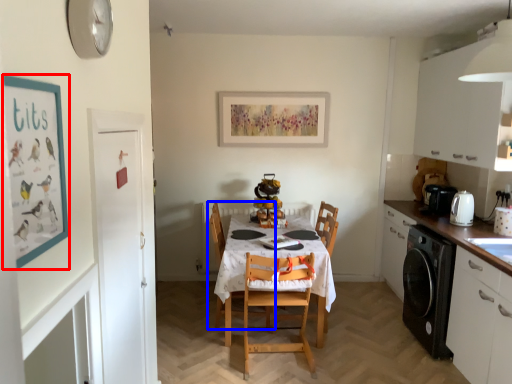
Question: Which object is further to the camera taking this photo, bulletin board (highlighted by a red box) or chair (highlighted by a blue box)?

Choices:
 (A) bulletin board
 (B) chair

Answer: (B)